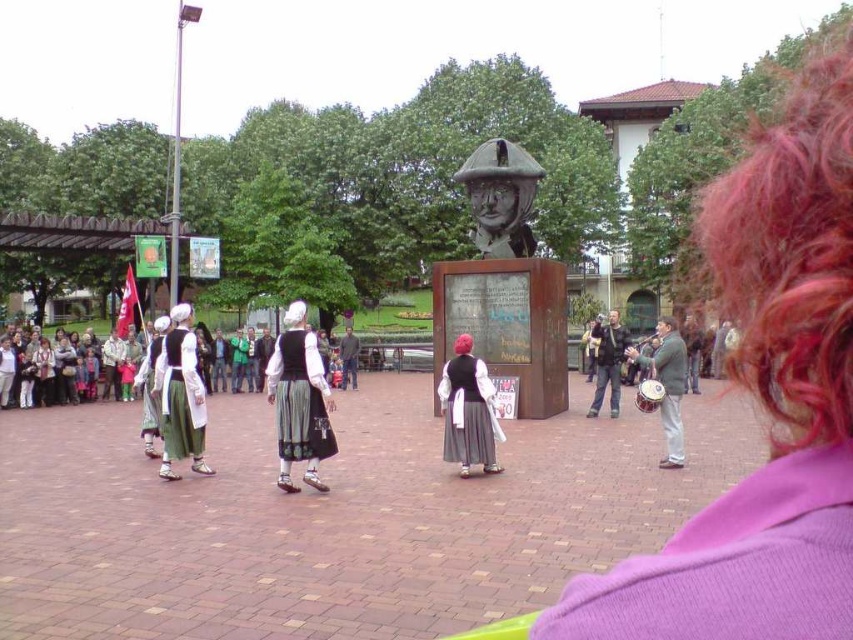
Question: Which is farther from the vivid pink hair at upper right?

Choices:
 (A) purple knit sweater at lower right
 (B) purple fabric at center
 (C) matte black jacket at center

Answer: (C)

Question: Can you confirm if purple fabric at center is thinner than black velvet dress at center?

Choices:
 (A) yes
 (B) no

Answer: (B)

Question: Which of the following is the farthest from the observer?

Choices:
 (A) (650, 356)
 (B) (722, 634)
 (C) (186, 337)
 (D) (741, 301)

Answer: (A)

Question: Does vivid pink hair at upper right appear under dark gray fabric jacket at center?

Choices:
 (A) yes
 (B) no

Answer: (B)

Question: Where is vivid pink hair at upper right located in relation to dark gray fabric jacket at center in the image?

Choices:
 (A) above
 (B) below

Answer: (A)

Question: Among these objects, which one is farthest from the camera?

Choices:
 (A) purple fabric at center
 (B) green fabric drum at right

Answer: (B)